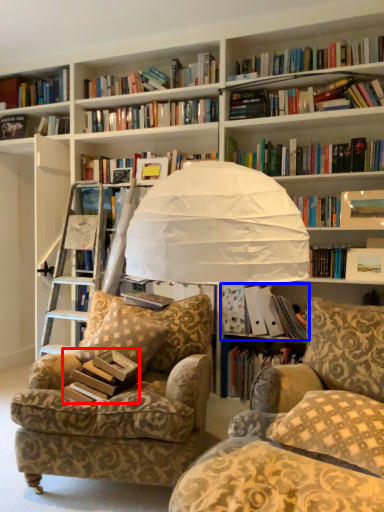
Question: Which object appears closest to the camera in this image, paperback book (highlighted by a red box) or book (highlighted by a blue box)?

Choices:
 (A) paperback book
 (B) book

Answer: (A)